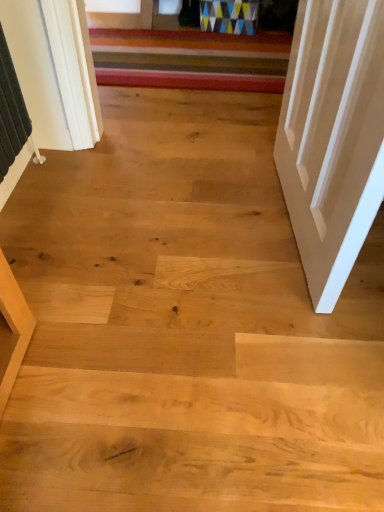
Image resolution: width=384 pixels, height=512 pixels. I want to click on white painted wood door at right, so click(333, 138).

What do you see at coordinates (333, 138) in the screenshot?
I see `white painted wood door at right` at bounding box center [333, 138].

This screenshot has width=384, height=512. Find the location of `white painted wood door at right`. white painted wood door at right is located at coordinates (333, 138).